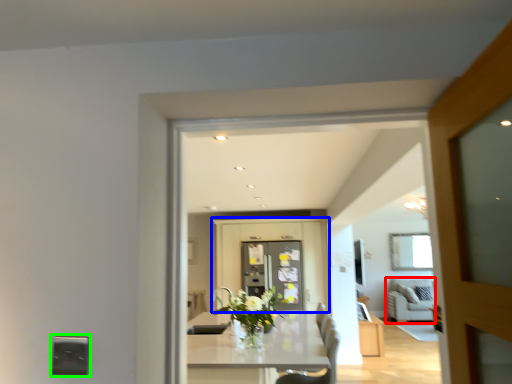
Question: Estimate the real-world distances between objects in this image. Which object is farther from couch (highlighted by a red box), cabinetry (highlighted by a blue box) or electric outlet (highlighted by a green box)?

Choices:
 (A) cabinetry
 (B) electric outlet

Answer: (B)